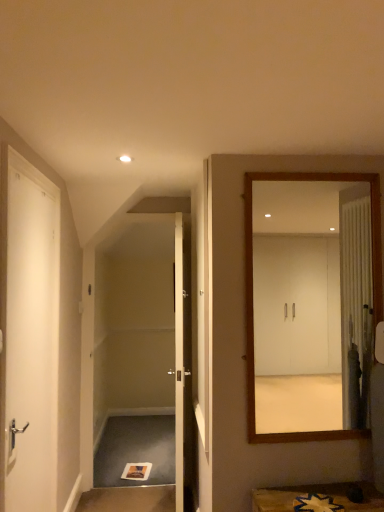
Find the location of `white glossy door at center, the 2th door viewed from the front`. white glossy door at center, the 2th door viewed from the front is located at coordinates (183, 364).

Where is `wooden mirror at right`? This screenshot has width=384, height=512. wooden mirror at right is located at coordinates (308, 301).

Find the location of a particular element. carpeted stair at lower left is located at coordinates (128, 499).

This screenshot has height=512, width=384. Find the location of `white matte door at left, arranged as the first door when viewed from the front`. white matte door at left, arranged as the first door when viewed from the front is located at coordinates (31, 341).

Considering the sizes of objects white matte door at left, which appears as the 2th door when viewed from the back, and carpeted stair at lower left in the image provided, who is thinner, white matte door at left, which appears as the 2th door when viewed from the back, or carpeted stair at lower left?

Thinner between the two is white matte door at left, which appears as the 2th door when viewed from the back.

Is white matte door at left, which appears as the 2th door when viewed from the back, completely or partially outside of carpeted stair at lower left?

Yes, white matte door at left, which appears as the 2th door when viewed from the back, is located beyond the bounds of carpeted stair at lower left.

Is the surface of white matte door at left, arranged as the first door when viewed from the front, in direct contact with carpeted stair at lower left?

white matte door at left, arranged as the first door when viewed from the front, and carpeted stair at lower left are not in contact.

Based on the photo, visually, is carpeted stair at lower left positioned to the left or to the right of white matte door at left, marked as the 2th door in a right-to-left arrangement?

Based on their positions, carpeted stair at lower left is located to the right of white matte door at left, marked as the 2th door in a right-to-left arrangement.

In the image, is carpeted stair at lower left positioned in front of or behind white matte door at left, arranged as the first door when viewed from the front?

carpeted stair at lower left is behind white matte door at left, arranged as the first door when viewed from the front.

Considering the positions of point (84, 508) and point (32, 399), is point (84, 508) closer or farther from the camera than point (32, 399)?

Point (84, 508) appears to be farther away from the viewer than point (32, 399).

Could you tell me if carpeted stair at lower left is facing white matte door at left, which appears as the 2th door when viewed from the back?

No, carpeted stair at lower left is not facing towards white matte door at left, which appears as the 2th door when viewed from the back.

Which of these two, wooden mirror at right or carpeted stair at lower left, stands taller?

wooden mirror at right is taller.

How distant is wooden mirror at right from carpeted stair at lower left?

1.71 meters.

From the image's perspective, which one is positioned higher, wooden mirror at right or carpeted stair at lower left?

From the image's view, wooden mirror at right is above.

Is wooden mirror at right to the right of carpeted stair at lower left from the viewer's perspective?

Yes.

From a real-world perspective, which object rests below the other?

carpeted stair at lower left.

Is white glossy door at center, the 2th door viewed from the front, to the right of carpeted stair at lower left from the viewer's perspective?

Yes, white glossy door at center, the 2th door viewed from the front, is to the right of carpeted stair at lower left.

Does point (191, 428) lie behind point (117, 490)?

No, it is not.

At what (x,y) coordinates should I click in order to perform the action: click on stair behind the white glossy door at center, which appears as the 1th door when viewed from the right. Please return your answer as a coordinate pair (x, y). Looking at the image, I should click on (128, 499).

From a real-world perspective, who is located higher, carpeted stair at lower left or wooden mirror at right?

In real-world perspective, wooden mirror at right is above.

Measure the distance between carpeted stair at lower left and wooden mirror at right.

A distance of 5.61 feet exists between carpeted stair at lower left and wooden mirror at right.

Who is bigger, carpeted stair at lower left or wooden mirror at right?

With larger size is wooden mirror at right.

Considering the positions of objects white glossy door at center, the 2th door viewed from the front, and white matte door at left, marked as the 2th door in a right-to-left arrangement, in the image provided, who is more to the left, white glossy door at center, the 2th door viewed from the front, or white matte door at left, marked as the 2th door in a right-to-left arrangement,?

From the viewer's perspective, white matte door at left, marked as the 2th door in a right-to-left arrangement, appears more on the left side.

From a real-world perspective, between white glossy door at center, which is the second door from left to right, and white matte door at left, which appears as the 2th door when viewed from the back, who is vertically higher?

In real-world perspective, white matte door at left, which appears as the 2th door when viewed from the back, is above.

Does white matte door at left, arranged as the first door when viewed from the front, contain wooden mirror at right?

That's incorrect, wooden mirror at right is not inside white matte door at left, arranged as the first door when viewed from the front.

This screenshot has height=512, width=384. What are the coordinates of `door that is the 1st one below the wooden mirror at right (from a real-world perspective)` in the screenshot? It's located at (31, 341).

Is white matte door at left, arranged as the first door when viewed from the front, smaller than wooden mirror at right?

Incorrect, white matte door at left, arranged as the first door when viewed from the front, is not smaller in size than wooden mirror at right.

Is wooden mirror at right at the back of white matte door at left, the 1th door positioned from the left?

white matte door at left, the 1th door positioned from the left, does not have its back to wooden mirror at right.

The width and height of the screenshot is (384, 512). What are the coordinates of `stair directly beneath the white matte door at left, marked as the 2th door in a right-to-left arrangement (from a real-world perspective)` in the screenshot? It's located at (128, 499).

Locate an element on the screen. Image resolution: width=384 pixels, height=512 pixels. stair below the white matte door at left, which appears as the 2th door when viewed from the back (from the image's perspective) is located at coordinates [x=128, y=499].

Estimate the real-world distances between objects in this image. Which object is further from wooden mirror at right, carpeted stair at lower left or white matte door at left, the 1th door positioned from the left?

carpeted stair at lower left is further to wooden mirror at right.

Based on the photo, estimate the real-world distances between objects in this image. Which object is closer to white glossy door at center, which appears as the 1th door when viewed from the right, carpeted stair at lower left or wooden mirror at right?

carpeted stair at lower left is positioned closer to the anchor white glossy door at center, which appears as the 1th door when viewed from the right.

Which object lies nearer to the anchor point white glossy door at center, the first door positioned from the back, carpeted stair at lower left or white matte door at left, marked as the 2th door in a right-to-left arrangement?

The object closer to white glossy door at center, the first door positioned from the back, is carpeted stair at lower left.

Estimate the real-world distances between objects in this image. Which object is further from white glossy door at center, the 2th door viewed from the front, white matte door at left, the 1th door positioned from the left, or carpeted stair at lower left?

white matte door at left, the 1th door positioned from the left, is positioned further to the anchor white glossy door at center, the 2th door viewed from the front.

Estimate the real-world distances between objects in this image. Which object is closer to wooden mirror at right, white glossy door at center, the 2th door viewed from the front, or carpeted stair at lower left?

white glossy door at center, the 2th door viewed from the front, is positioned closer to the anchor wooden mirror at right.

When comparing their distances from white glossy door at center, the first door positioned from the back, does wooden mirror at right or white matte door at left, marked as the 2th door in a right-to-left arrangement, seem closer?

Among the two, wooden mirror at right is located nearer to white glossy door at center, the first door positioned from the back.

When comparing their distances from wooden mirror at right, does white matte door at left, marked as the 2th door in a right-to-left arrangement, or carpeted stair at lower left seem closer?

white matte door at left, marked as the 2th door in a right-to-left arrangement.

Looking at the image, which one is located closer to white glossy door at center, the first door positioned from the back, wooden mirror at right or carpeted stair at lower left?

carpeted stair at lower left.

I want to click on door between white matte door at left, marked as the 2th door in a right-to-left arrangement, and carpeted stair at lower left from top to bottom, so click(x=183, y=364).

Image resolution: width=384 pixels, height=512 pixels. I want to click on door between white matte door at left, marked as the 2th door in a right-to-left arrangement, and wooden mirror at right, so click(x=183, y=364).